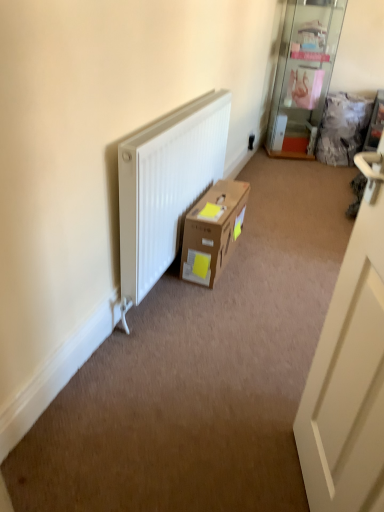
Question: Is white matte door at right in front of transparent glass shelf at upper right?

Choices:
 (A) yes
 (B) no

Answer: (A)

Question: Could you tell me if white matte door at right is turned towards transparent glass shelf at upper right?

Choices:
 (A) no
 (B) yes

Answer: (A)

Question: Is white matte door at right shorter than transparent glass shelf at upper right?

Choices:
 (A) yes
 (B) no

Answer: (B)

Question: Is white matte door at right smaller than transparent glass shelf at upper right?

Choices:
 (A) yes
 (B) no

Answer: (A)

Question: Is transparent glass shelf at upper right located within white matte door at right?

Choices:
 (A) no
 (B) yes

Answer: (A)

Question: Which is correct: brown cardboard box at center is inside white matte door at right, or outside of it?

Choices:
 (A) inside
 (B) outside

Answer: (B)

Question: In the image, is brown cardboard box at center on the left side or the right side of white matte door at right?

Choices:
 (A) right
 (B) left

Answer: (B)

Question: Is brown cardboard box at center in front of or behind white matte door at right in the image?

Choices:
 (A) front
 (B) behind

Answer: (B)

Question: In terms of size, does brown cardboard box at center appear bigger or smaller than white matte door at right?

Choices:
 (A) small
 (B) big

Answer: (A)

Question: Is point (195, 259) closer or farther from the camera than point (307, 49)?

Choices:
 (A) farther
 (B) closer

Answer: (B)

Question: From the image's perspective, relative to transparent glass shelf at upper right, is brown cardboard box at center above or below?

Choices:
 (A) below
 (B) above

Answer: (A)

Question: In terms of width, does brown cardboard box at center look wider or thinner when compared to transparent glass shelf at upper right?

Choices:
 (A) thin
 (B) wide

Answer: (A)

Question: Is brown cardboard box at center taller or shorter than transparent glass shelf at upper right?

Choices:
 (A) short
 (B) tall

Answer: (A)

Question: Does point (332, 32) appear closer or farther from the camera than point (208, 197)?

Choices:
 (A) farther
 (B) closer

Answer: (A)

Question: Visually, is transparent glass shelf at upper right positioned to the left or to the right of brown cardboard box at center?

Choices:
 (A) left
 (B) right

Answer: (B)